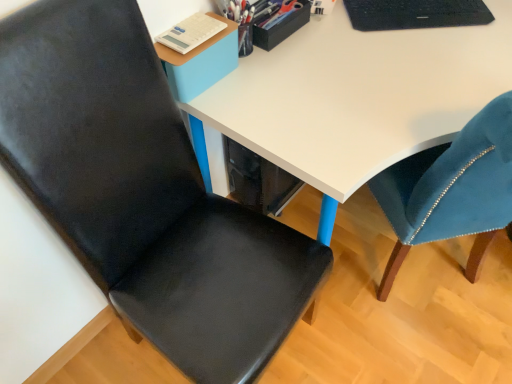
What are the coordinates of `vacant area that lies to the right of metallic pen holder at upper center` in the screenshot? It's located at (331, 37).